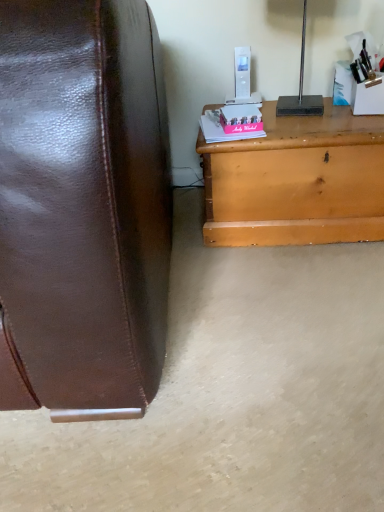
The width and height of the screenshot is (384, 512). What do you see at coordinates (297, 181) in the screenshot?
I see `wooden nightstand at right` at bounding box center [297, 181].

From the picture: In order to face wooden nightstand at right, should I rotate leftwards or rightwards?

Turn right by 14.959 degrees to look at wooden nightstand at right.

Where is `wooden nightstand at right`? wooden nightstand at right is located at coordinates (297, 181).

This screenshot has height=512, width=384. In order to click on wooden nightstand at right in this screenshot , I will do pyautogui.click(x=297, y=181).